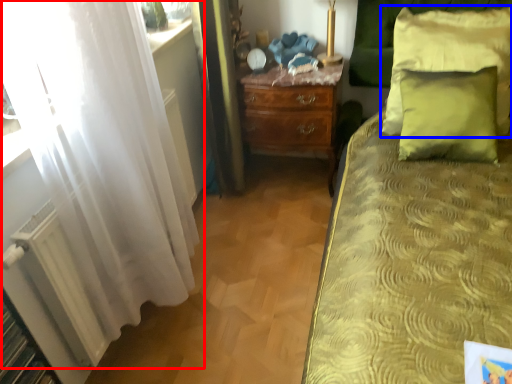
Question: Which point is further to the camera, curtain (highlighted by a red box) or pillow (highlighted by a blue box)?

Choices:
 (A) curtain
 (B) pillow

Answer: (B)